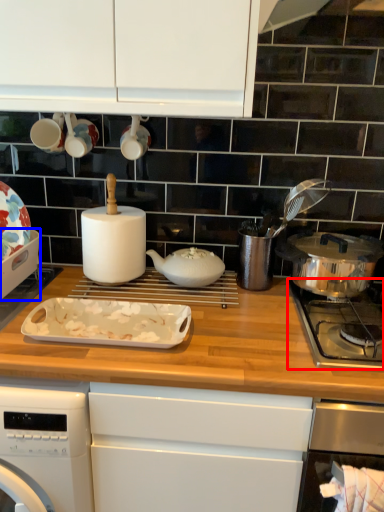
Question: Which object appears farthest to the camera in this image, gas stove (highlighted by a red box) or kitchen appliance (highlighted by a blue box)?

Choices:
 (A) gas stove
 (B) kitchen appliance

Answer: (B)